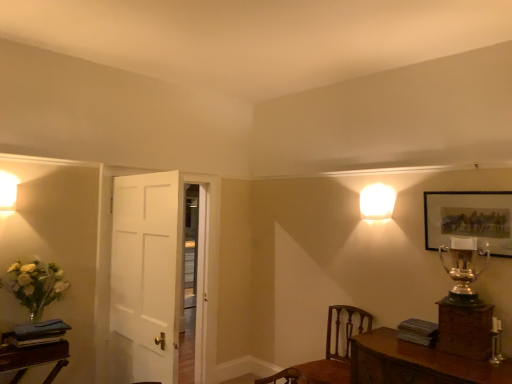
Question: Based on their sizes in the image, would you say gold metallic trophy at upper right is bigger or smaller than wooden table at lower right?

Choices:
 (A) small
 (B) big

Answer: (A)

Question: Which is correct: gold metallic trophy at upper right is inside wooden table at lower right, or outside of it?

Choices:
 (A) inside
 (B) outside

Answer: (B)

Question: Which of these objects is positioned closest to the matte gold picture frame at upper right?

Choices:
 (A) matte white sconce at upper left, the second lamp in the right-to-left sequence
 (B) wooden table at lower right
 (C) translucent glass vase at lower left
 (D) gold metallic trophy at upper right
 (E) white glossy square at upper right, the 2th lamp positioned from the left

Answer: (D)

Question: Which object is positioned closest to the translucent glass vase at lower left?

Choices:
 (A) brown wood chair at lower right
 (B) wooden table at lower right
 (C) matte white sconce at upper left, arranged as the 2th lamp when viewed from the back
 (D) white wooden door at center
 (E) gold metallic trophy at upper right

Answer: (C)